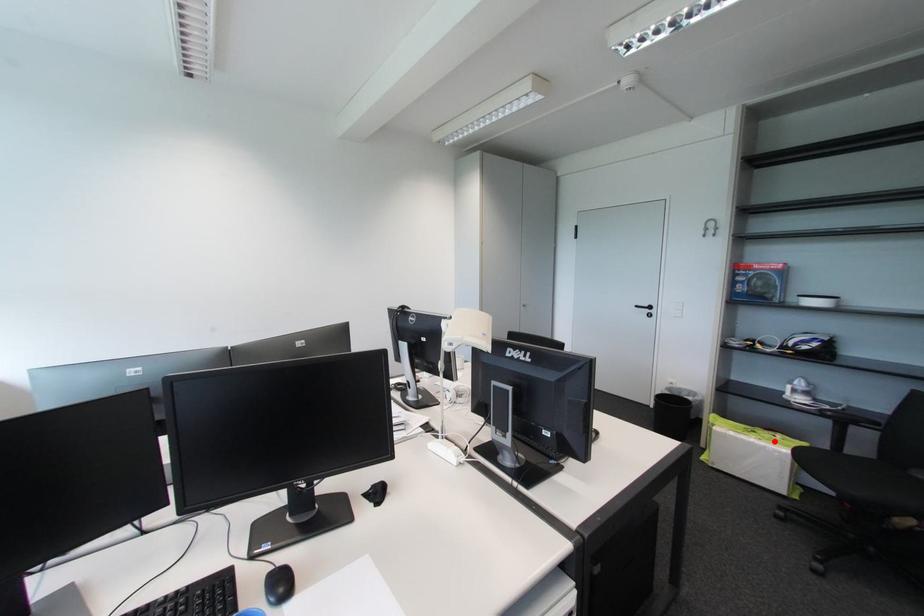
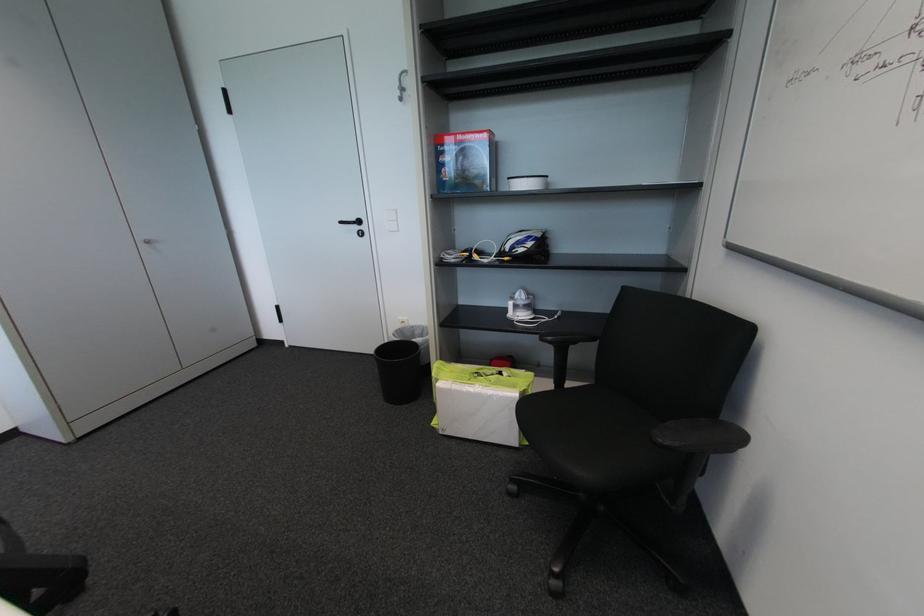
Find the pixel in the second image that matches the highlighted location in the first image.

(501, 386)